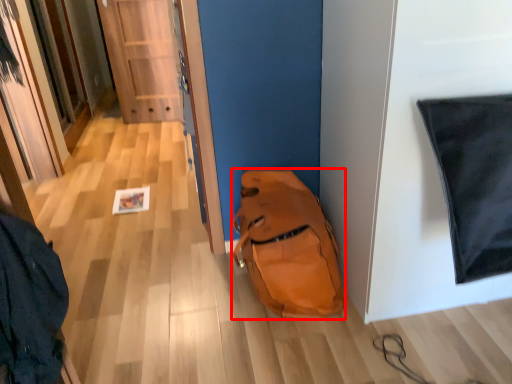
Question: From the image's perspective, considering the relative positions of backpack (annotated by the red box) and door in the image provided, where is backpack (annotated by the red box) located with respect to the staircase?

Choices:
 (A) below
 (B) above

Answer: (A)